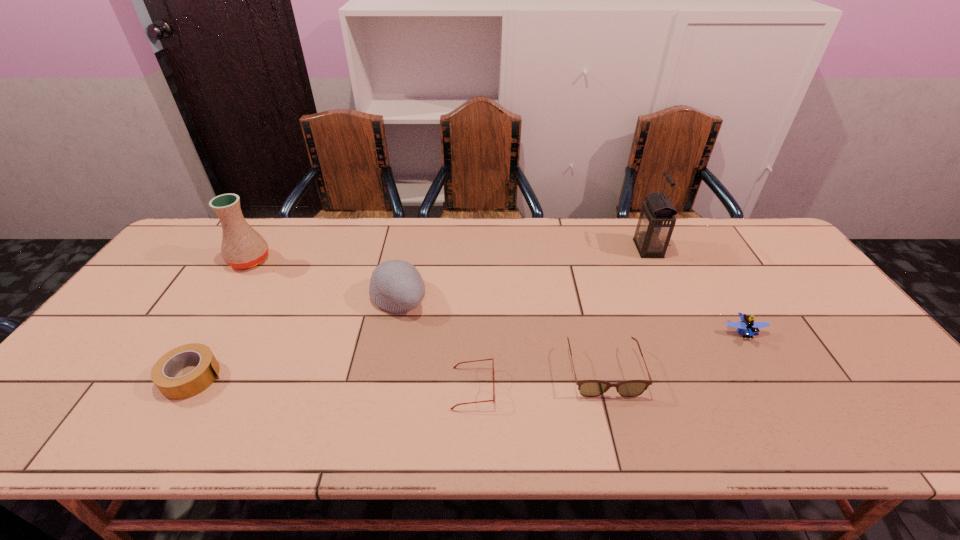
Where is `free space between the beanie and the sixth shortest object`? The width and height of the screenshot is (960, 540). free space between the beanie and the sixth shortest object is located at coordinates (324, 279).

The image size is (960, 540). Find the location of `free space that is in between the left spectacles and the Lego`. free space that is in between the left spectacles and the Lego is located at coordinates (609, 360).

In order to click on free spot between the pottery and the shorter spectacles in this screenshot , I will do `click(361, 324)`.

Where is `vacant region between the rightmost object and the third object from right to left`? vacant region between the rightmost object and the third object from right to left is located at coordinates (674, 352).

Where is `unoccupied area between the shorter spectacles and the fifth shortest object`? The width and height of the screenshot is (960, 540). unoccupied area between the shorter spectacles and the fifth shortest object is located at coordinates (435, 342).

You are a GUI agent. You are given a task and a screenshot of the screen. Output one action in this format:
    pyautogui.click(x=<x>, y=<y>)
    Task: Click on the free space between the third tallest object and the Lego
    The image size is (960, 540).
    Given the screenshot: What is the action you would take?
    pyautogui.click(x=570, y=315)

Where is `unoccupied area between the duct tape and the fifth shortest object`? The image size is (960, 540). unoccupied area between the duct tape and the fifth shortest object is located at coordinates (295, 337).

Identify which object is located as the nearest to the Lego. Please provide its 2D coordinates. Your answer should be formatted as a tuple, i.e. [(x, y)], where the tuple contains the x and y coordinates of a point satisfying the conditions above.

[(589, 388)]

Identify which object is located as the second nearest to the third tallest object. Please provide its 2D coordinates. Your answer should be formatted as a tuple, i.e. [(x, y)], where the tuple contains the x and y coordinates of a point satisfying the conditions above.

[(166, 368)]

You are a GUI agent. You are given a task and a screenshot of the screen. Output one action in this format:
    pyautogui.click(x=<x>, y=<y>)
    Task: Click on the free region that satisfies the following two spatial constraints: 1. on the front-facing side of the tallest object; 2. on the front side of the fifth object from right to left
    
    Given the screenshot: What is the action you would take?
    pyautogui.click(x=671, y=297)